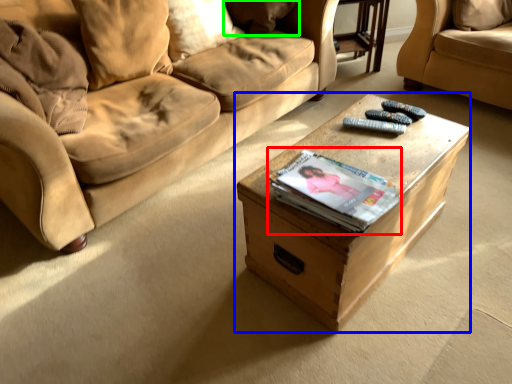
Question: Based on their relative distances, which object is nearer to paperback book (highlighted by a red box)? Choose from table (highlighted by a blue box) and pillow (highlighted by a green box).

Choices:
 (A) table
 (B) pillow

Answer: (A)